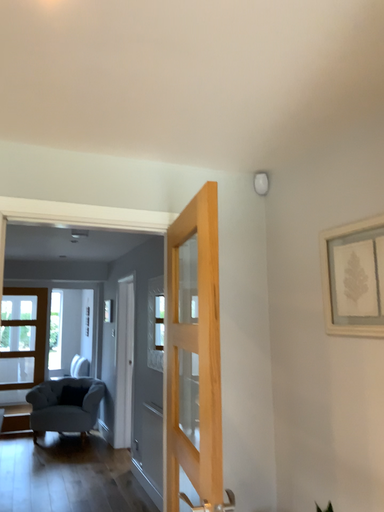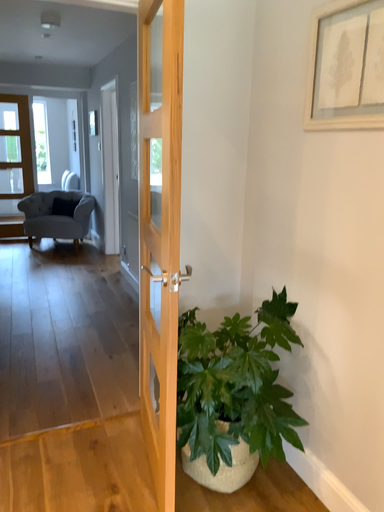
Question: How did the camera likely rotate when shooting the video?

Choices:
 (A) rotated downward
 (B) rotated upward

Answer: (A)